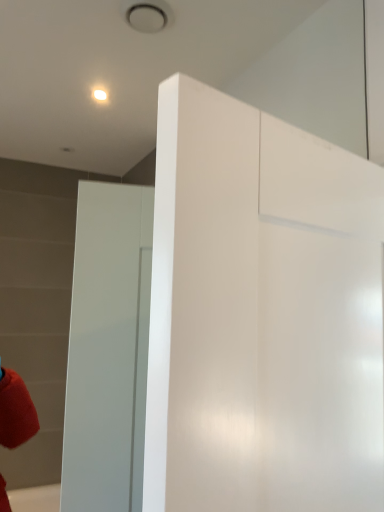
Question: Should I look upward or downward to see white glossy dresser at center?

Choices:
 (A) down
 (B) up

Answer: (A)